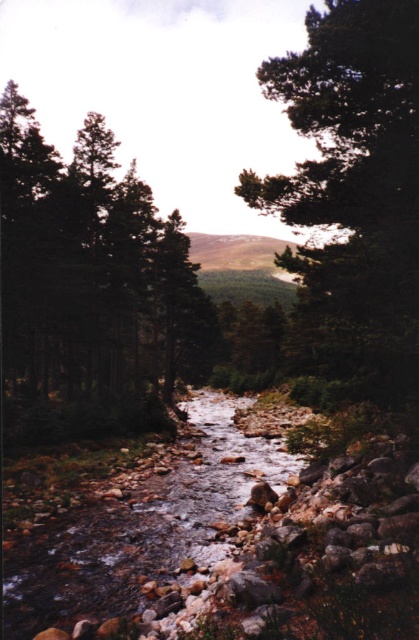
You are a hiker trying to cross the stream. You notice the green matte tree at left and the clear water at stream center. Which object would you consider first when planning your path to ensure stability?

The green matte tree at left is larger in size than the clear water at stream center, so you should consider the green matte tree at left first as its larger size may provide a stable anchor point or indicate a solid bank for crossing.

Based on the scene description, where is the green matte tree at center located in the image?

The green matte tree at center is located at point (354, 182).

You are a hiker who wants to cross the stream at the clear water at stream center. There is a green matte tree at center nearby. Which direction should you walk to reach the tree after crossing the stream?

The green matte tree at center is positioned on the right side of clear water at stream center. After crossing the stream, you should walk to the right to reach the tree.